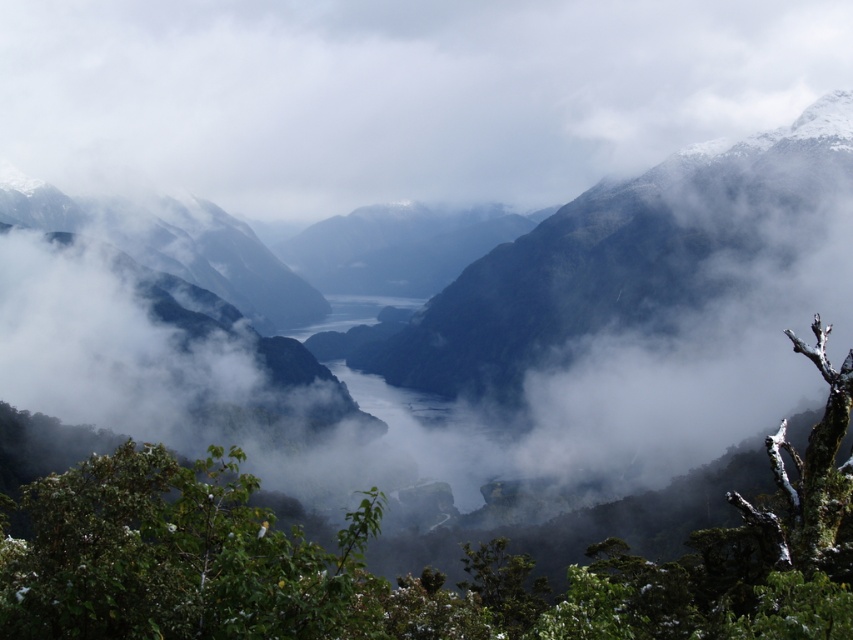
Does white fluffy cloud at center have a greater width compared to green leafy tree at center?

Indeed, white fluffy cloud at center has a greater width compared to green leafy tree at center.

In the scene shown: Is white fluffy cloud at center shorter than green leafy tree at center?

In fact, white fluffy cloud at center may be taller than green leafy tree at center.

Between point (41, 61) and point (239, 580), which one is positioned in front?

Point (239, 580)

Locate an element on the screen. The height and width of the screenshot is (640, 853). white fluffy cloud at center is located at coordinates (395, 93).